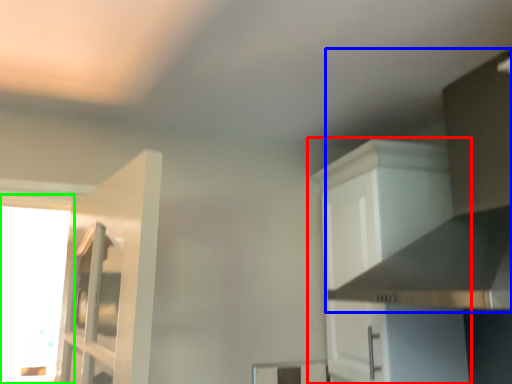
Question: Which object is positioned closest to cabinetry (highlighted by a red box)? Select from vent (highlighted by a blue box) and window (highlighted by a green box).

Choices:
 (A) vent
 (B) window

Answer: (A)